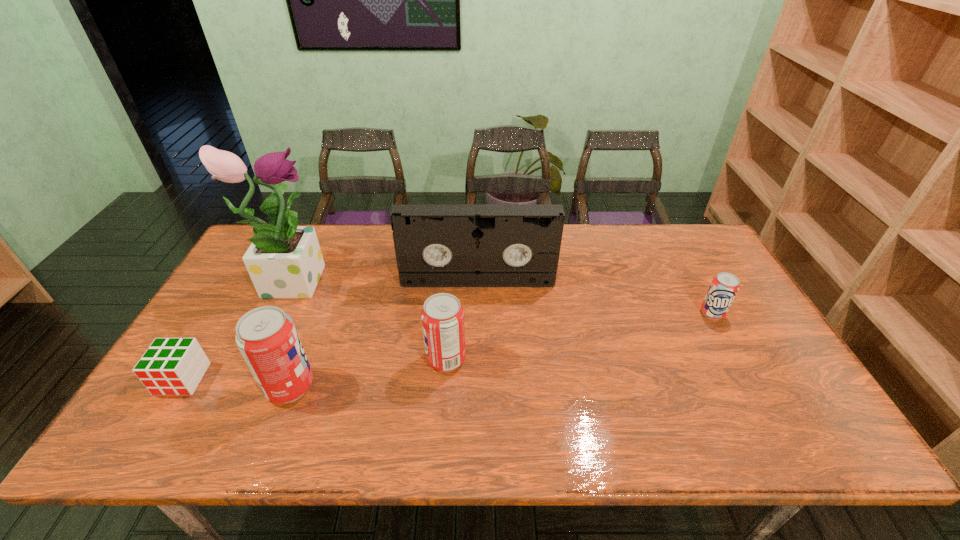
The width and height of the screenshot is (960, 540). Identify the location of the leftmost soda can. (267, 338).

Image resolution: width=960 pixels, height=540 pixels. In order to click on the second shortest soda can in this screenshot , I will do `click(442, 316)`.

Image resolution: width=960 pixels, height=540 pixels. In order to click on the fourth tallest object in this screenshot , I will do `click(442, 316)`.

This screenshot has height=540, width=960. Identify the location of the rightmost soda can. (724, 287).

Find the location of a particular element. the shortest soda can is located at coordinates (724, 287).

I want to click on the tallest object, so click(x=284, y=261).

At what (x,y) coordinates should I click in order to perform the action: click on videotape. Please return your answer as a coordinate pair (x, y). The image size is (960, 540). Looking at the image, I should click on (436, 245).

This screenshot has width=960, height=540. What are the coordinates of `the shortest object` in the screenshot? It's located at (170, 366).

You are a GUI agent. You are given a task and a screenshot of the screen. Output one action in this format:
    pyautogui.click(x=<x>, y=<y>)
    Task: Click on the blank area located 0.090m on the left of the leftmost soda can
    
    Given the screenshot: What is the action you would take?
    pyautogui.click(x=228, y=387)

Where is `vacant area located 0.280m on the left of the third shortest object`? This screenshot has width=960, height=540. vacant area located 0.280m on the left of the third shortest object is located at coordinates (318, 360).